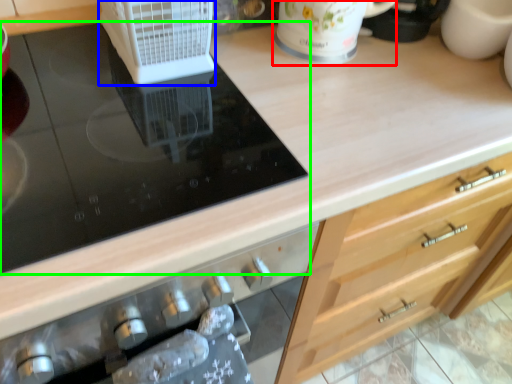
Question: Which is nearer to the mug (highlighted by a red box)? kitchen appliance (highlighted by a blue box) or gas stove (highlighted by a green box).

Choices:
 (A) kitchen appliance
 (B) gas stove

Answer: (A)